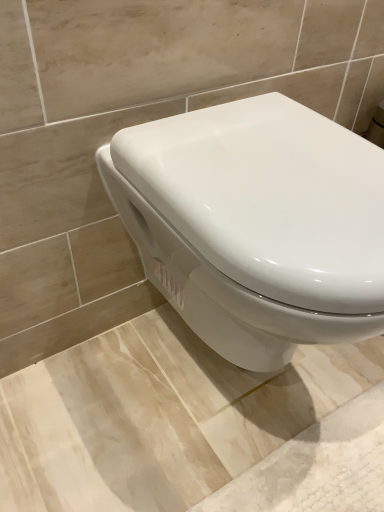
Locate an element on the screen. empty space that is ontop of white glossy toilet at center (from a real-world perspective) is located at coordinates (270, 155).